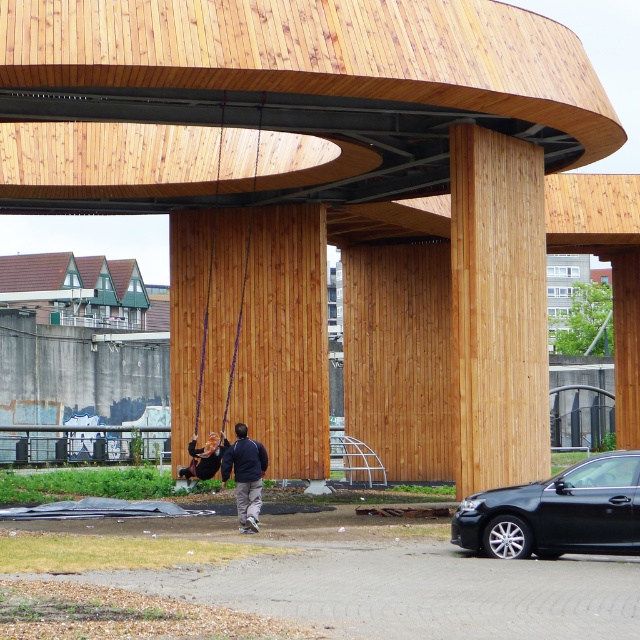
You are standing at the point marked as point (x=227, y=385) in the image. What object is located exactly at this point?

The purple fabric swing at center is located exactly at point (x=227, y=385).

You are planning to hang a new swing in your backyard and want to ensure there is enough space between the purple fabric swing at center and the dark blue jacket at center. Given that the swing is wider than the jacket, what should you consider when choosing the location for your swing?

The purple fabric swing at center is wider than the dark blue jacket at center, so you should ensure there is sufficient space around the swing to accommodate its width, especially when it is in motion, to prevent it from coming into contact with the jacket or any nearby objects.

You are standing in front of the modern wooden structure and want to take a photo of the dark blue jacket at center and the matte black swing at lower left. Which object should you focus on first to ensure both are in the frame?

The dark blue jacket at center is in front of the matte black swing at lower left, so you should focus on the matte black swing at lower left first to ensure both are in the frame.